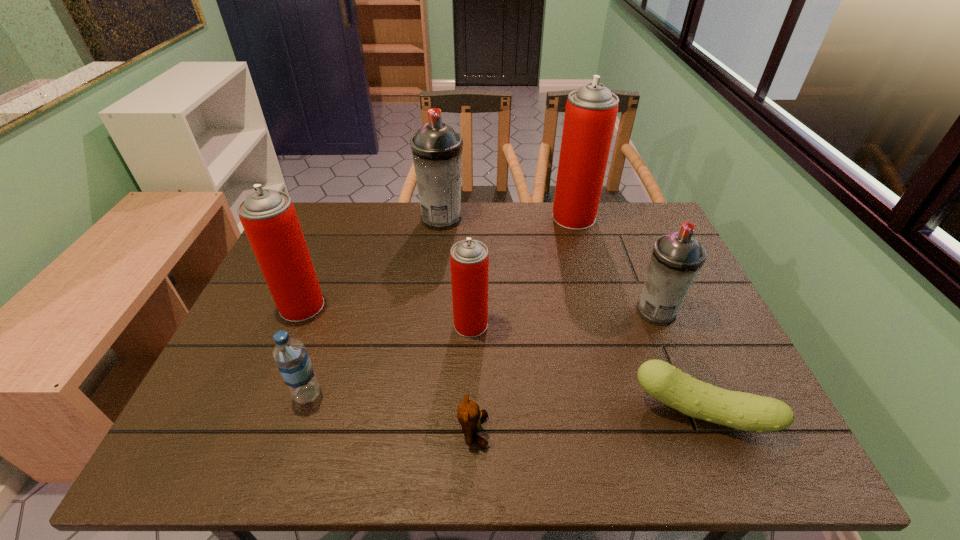
Find the location of `vacant area located 0.340m on the front-facing side of the brown teddy bear`. vacant area located 0.340m on the front-facing side of the brown teddy bear is located at coordinates (657, 431).

Where is `cucumber located at the near edge`? The height and width of the screenshot is (540, 960). cucumber located at the near edge is located at coordinates tap(744, 411).

Find the location of a particular element. The image size is (960, 540). teddy bear present at the near edge is located at coordinates (469, 415).

This screenshot has height=540, width=960. Find the location of `object at the left edge`. object at the left edge is located at coordinates (269, 218).

Image resolution: width=960 pixels, height=540 pixels. I want to click on aerosol can that is positioned at the right edge, so click(677, 258).

The height and width of the screenshot is (540, 960). In order to click on cucumber that is at the right edge in this screenshot , I will do `click(744, 411)`.

Where is `object that is at the near right corner`? The image size is (960, 540). object that is at the near right corner is located at coordinates (744, 411).

Locate an element on the screen. The width and height of the screenshot is (960, 540). vacant space at the far edge of the desktop is located at coordinates (375, 235).

Find the location of `vacant point at the near edge`. vacant point at the near edge is located at coordinates (412, 442).

You are a GUI agent. You are given a task and a screenshot of the screen. Output one action in this format:
    pyautogui.click(x=<x>, y=<y>)
    Task: Click on the vacant area at the left edge
    Image resolution: width=960 pixels, height=540 pixels.
    Given the screenshot: What is the action you would take?
    pyautogui.click(x=226, y=403)